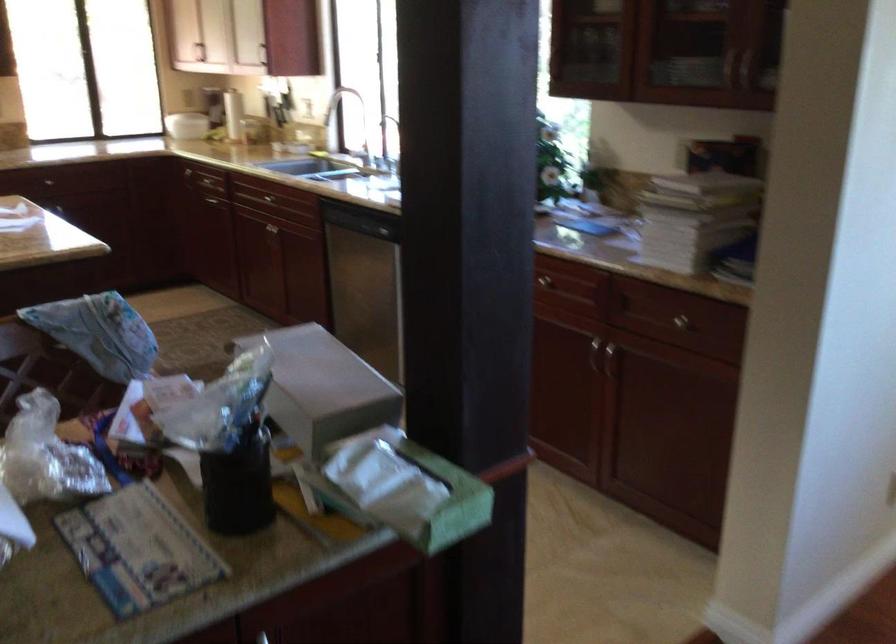
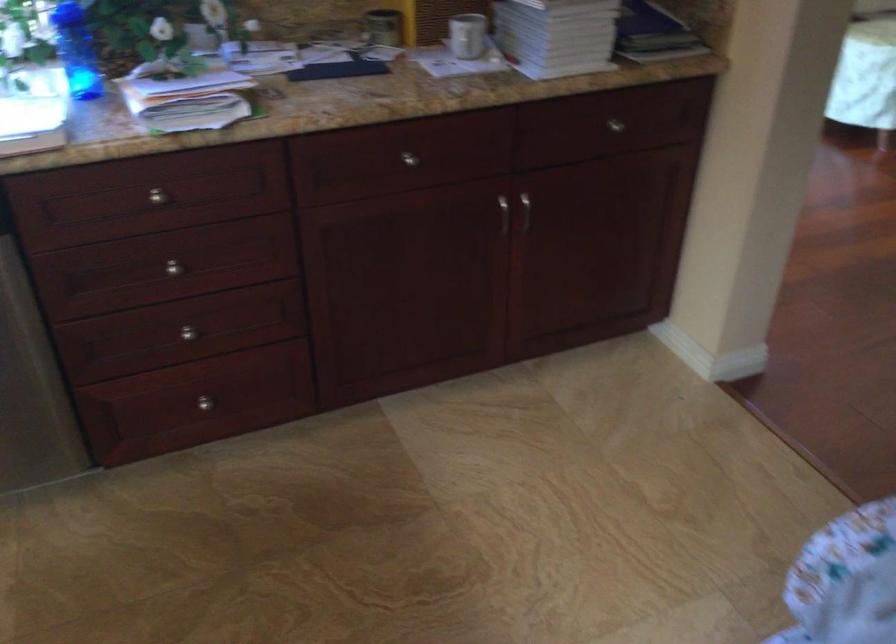
The point at (x=684, y=324) is marked in the first image. Where is the corresponding point in the second image?

(615, 125)